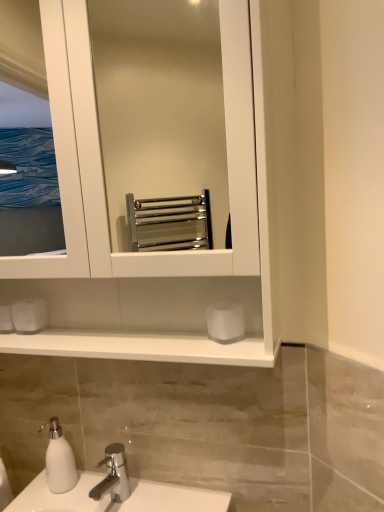
Question: Is white glossy towel rack at center to the left or to the right of white matte soap dispenser at lower left in the image?

Choices:
 (A) right
 (B) left

Answer: (A)

Question: Is white glossy towel rack at center inside the boundaries of white matte soap dispenser at lower left, or outside?

Choices:
 (A) inside
 (B) outside

Answer: (B)

Question: Which of these objects is positioned farthest from the white matte toilet paper at lower left, the first toilet paper positioned from the left?

Choices:
 (A) white matte soap dispenser at lower left
 (B) silver metallic tap at lower center
 (C) white matte toilet paper at center, the 2th toilet paper positioned from the back
 (D) white glossy towel rack at center

Answer: (C)

Question: Which object is positioned farthest from the white matte toilet paper at lower left, acting as the second toilet paper starting from the front?

Choices:
 (A) white glossy towel rack at center
 (B) white matte toilet paper at center, marked as the first toilet paper in a front-to-back arrangement
 (C) silver metallic tap at lower center
 (D) white matte soap dispenser at lower left

Answer: (B)